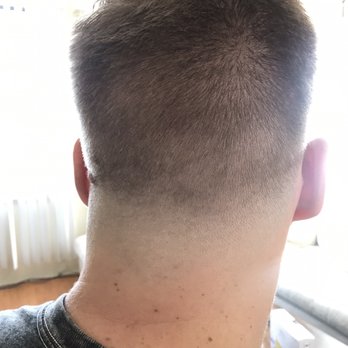
Find the location of a particular element. floor is located at coordinates (41, 296).